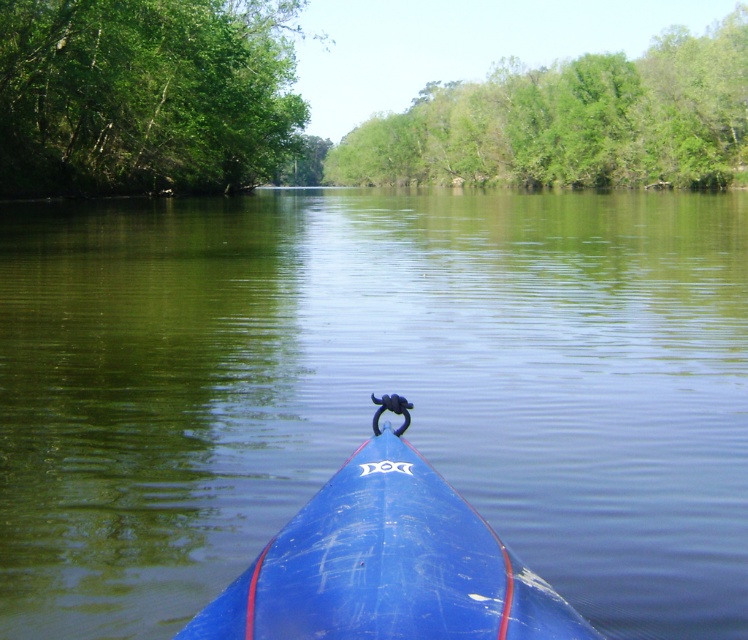
Question: Does green leafy trees at upper center have a greater width compared to blue glossy kayak at center?

Choices:
 (A) no
 (B) yes

Answer: (B)

Question: Which point is farther to the camera?

Choices:
 (A) green leafy trees at upper center
 (B) blue glossy kayak at center

Answer: (A)

Question: Among these points, which one is farthest from the camera?

Choices:
 (A) (260, 412)
 (B) (206, 612)

Answer: (A)

Question: Is green leafy trees at upper left in front of green leafy trees at upper center?

Choices:
 (A) no
 (B) yes

Answer: (B)

Question: Can you confirm if green leafy trees at upper left is bigger than blue glossy kayak at center?

Choices:
 (A) no
 (B) yes

Answer: (B)

Question: Estimate the real-world distances between objects in this image. Which object is closer to the blue glossy kayak at center?

Choices:
 (A) green leafy trees at upper center
 (B) green leafy trees at upper left

Answer: (B)